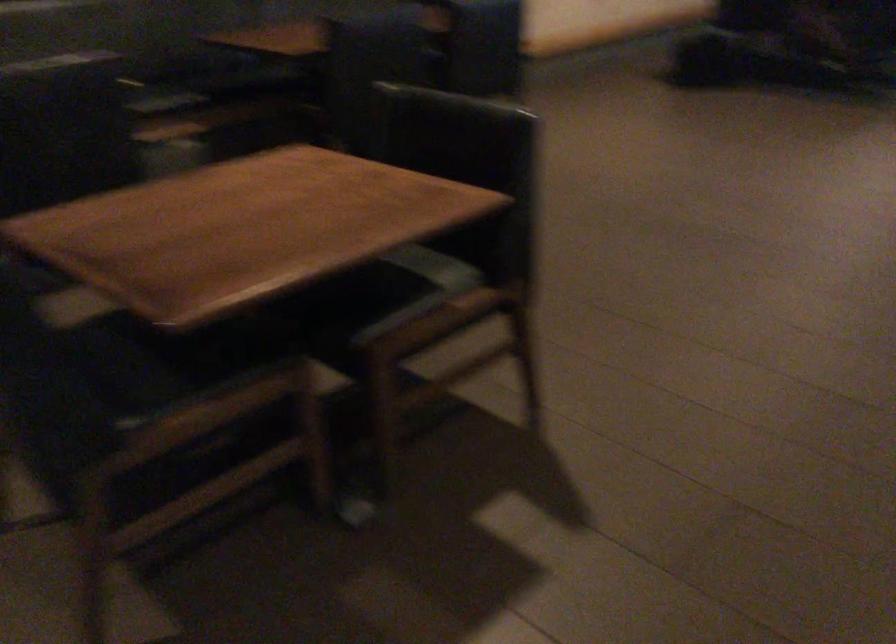
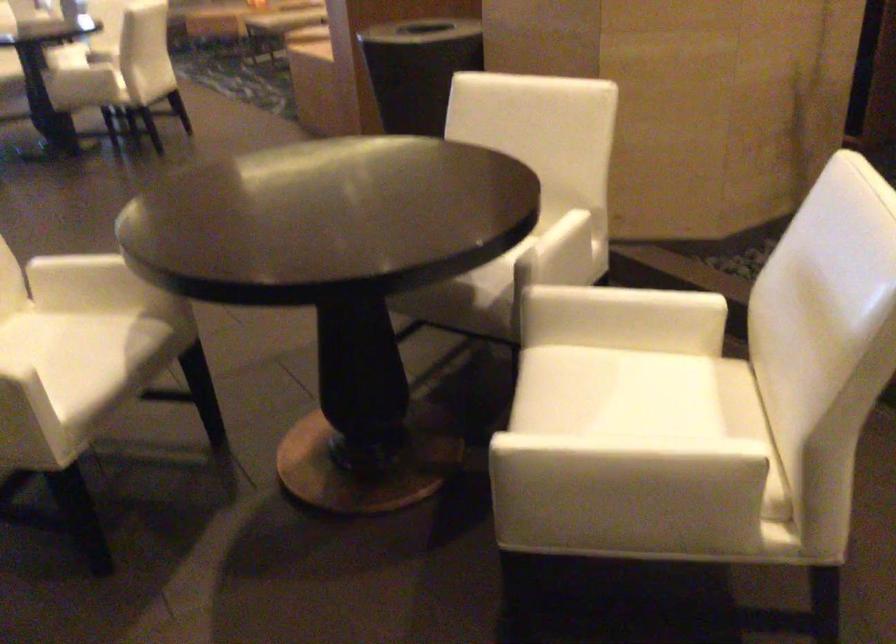
Question: The camera is either moving clockwise (left) or counter-clockwise (right) around the object. The first image is from the beginning of the video and the second image is from the end. Is the camera moving left or right when shooting the video?

Choices:
 (A) Left
 (B) Right

Answer: (A)